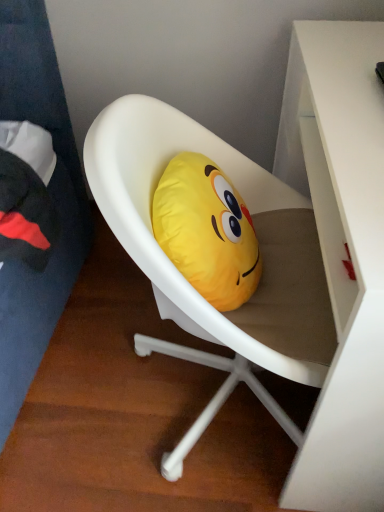
Question: From the image's perspective, is yellow fabric emoji pillow at center located above or below white matte chair at center?

Choices:
 (A) above
 (B) below

Answer: (A)

Question: Is yellow fabric emoji pillow at center wider or thinner than white matte chair at center?

Choices:
 (A) thin
 (B) wide

Answer: (A)

Question: Considering the real-world distances, which object is farthest from the yellow fabric emoji pillow at center?

Choices:
 (A) white matte chair at center
 (B) white glossy desk at upper right

Answer: (B)

Question: Estimate the real-world distances between objects in this image. Which object is farther from the white matte chair at center?

Choices:
 (A) yellow fabric emoji pillow at center
 (B) white glossy desk at upper right

Answer: (B)